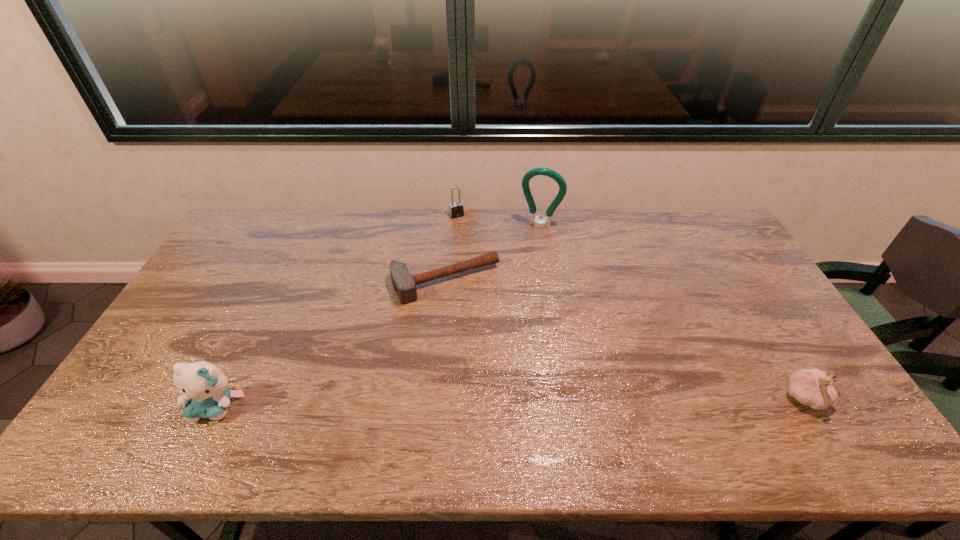
Where is `vacant spot on the desktop that is between the kitten and the rightmost object and is positioned on the striking surface of the third farthest object`? This screenshot has width=960, height=540. vacant spot on the desktop that is between the kitten and the rightmost object and is positioned on the striking surface of the third farthest object is located at coordinates (514, 402).

Locate an element on the screen. The width and height of the screenshot is (960, 540). free spot on the desktop that is between the fourth shortest object and the rightmost object and is positioned at the jaws of the bottle opener is located at coordinates (469, 403).

You are a GUI agent. You are given a task and a screenshot of the screen. Output one action in this format:
    pyautogui.click(x=<x>, y=<y>)
    Task: Click on the vacant space on the desktop that is between the leftmost object and the garlic and is positioned on the shackle of the padlock
    
    Given the screenshot: What is the action you would take?
    pyautogui.click(x=568, y=401)